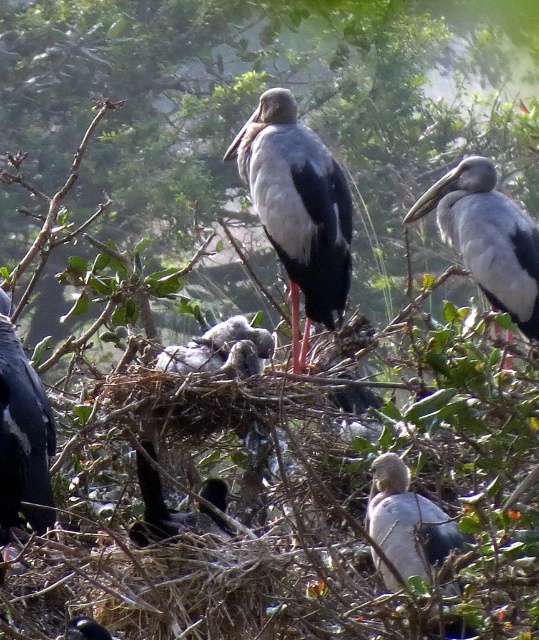
You are a birdwatcher observing the openbill storks. You notice the matte black bird at left and the white matte bird at lower center. Which bird is taller?

The matte black bird at left is taller than the white matte bird at lower center.

Based on the photo, you are a photographer aiming to capture the matte black bird at left in your frame. Based on its position, which corner of the image should you focus on to ensure it is centered?

The matte black bird at left is located at point (23, 436), which corresponds to the top left corner of the image. To center it, focus on that corner.

You are a birdwatcher observing the scene. You notice the matte black bird at left and the white matte bird at lower center. Which bird is positioned more to the east if the sun is rising in the east?

The matte black bird at left is positioned more to the east since it is to the left of the white matte bird at lower center, and the sun is rising in the east.